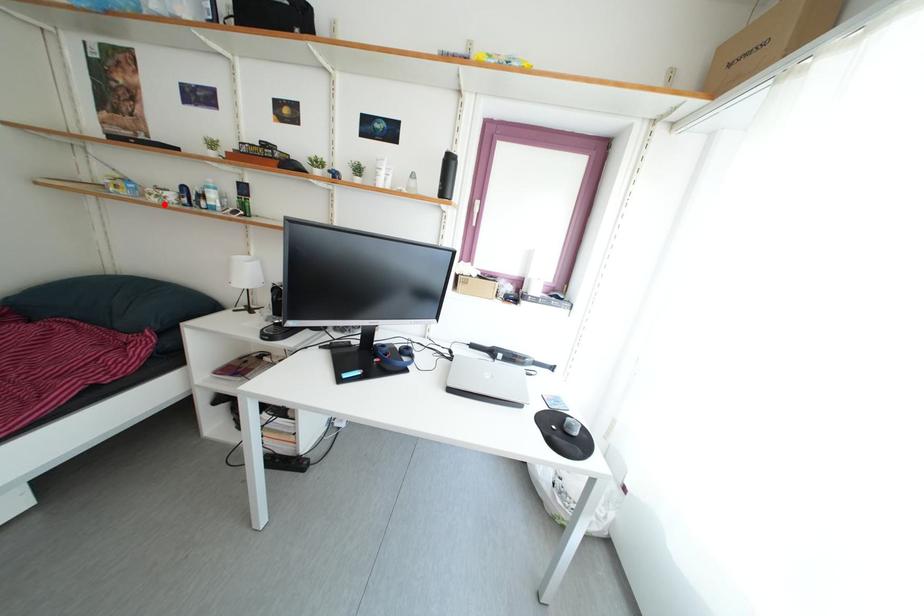
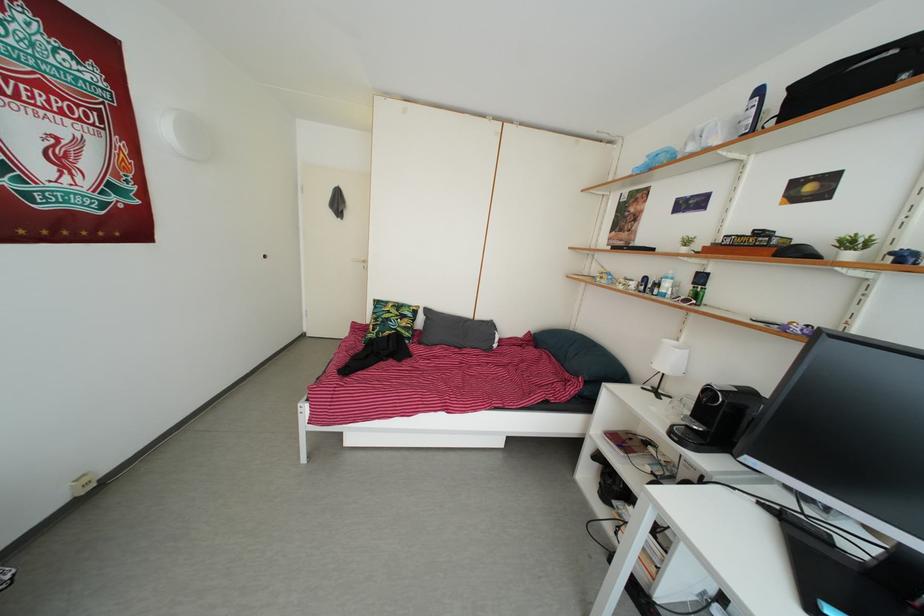
Find the pixel in the second image that matches the highlighted location in the first image.

(630, 293)